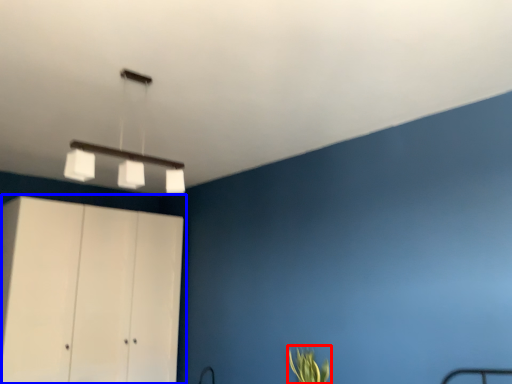
Question: Among these objects, which one is nearest to the camera, plant (highlighted by a red box) or cupboard (highlighted by a blue box)?

Choices:
 (A) plant
 (B) cupboard

Answer: (A)